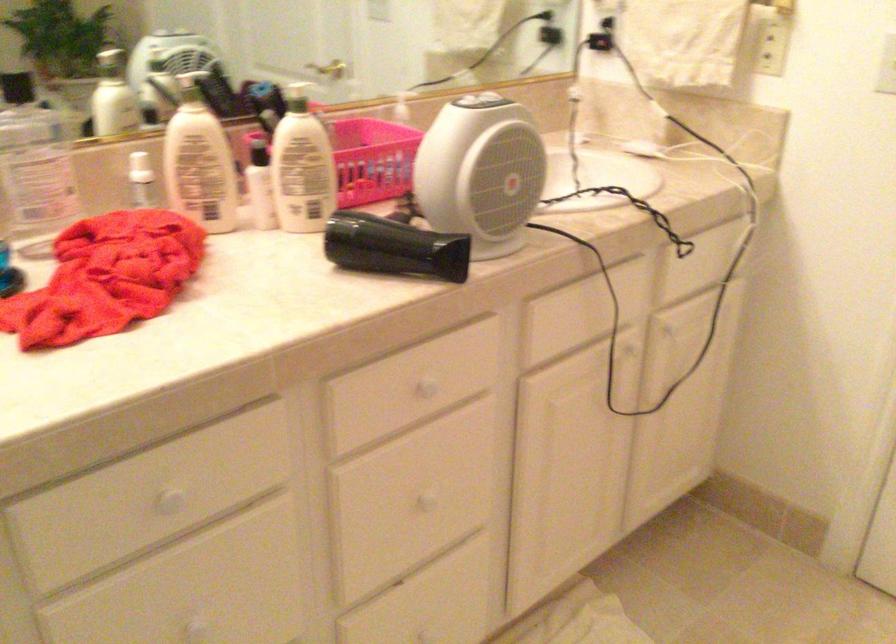
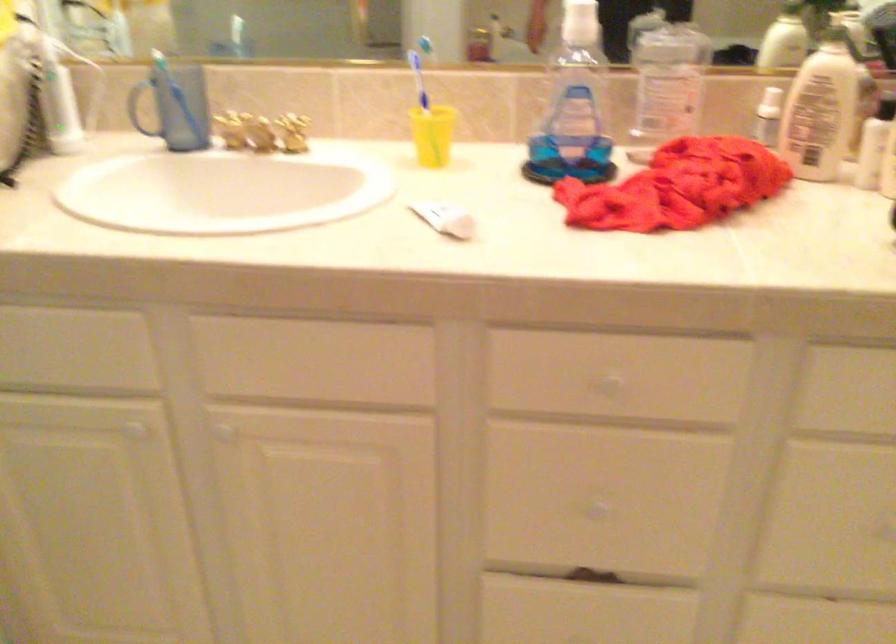
In the second image, find the point that corresponds to point 212,169 in the first image.

(821, 109)